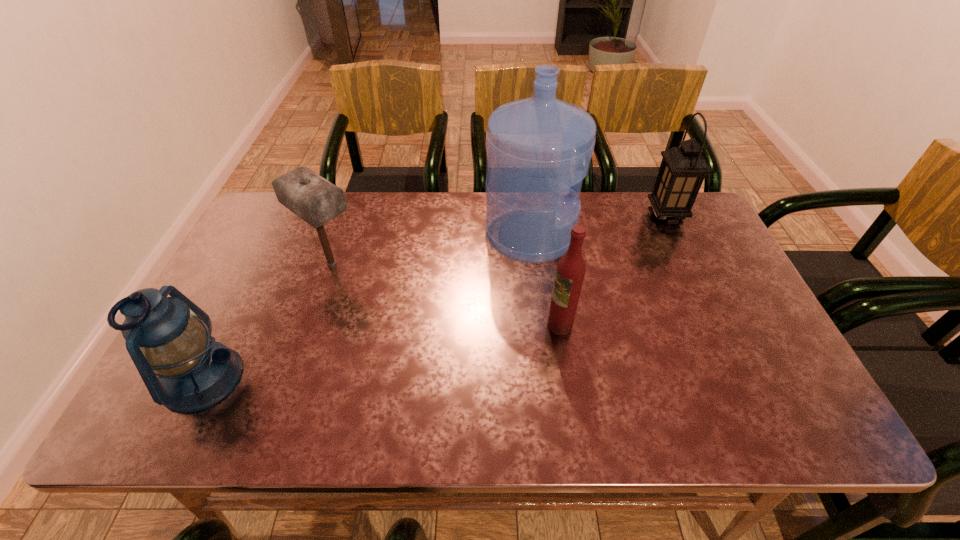
Locate an element on the screen. Image resolution: width=960 pixels, height=540 pixels. water jug is located at coordinates (539, 149).

I want to click on the farther lantern, so click(683, 169).

This screenshot has width=960, height=540. I want to click on the right lantern, so point(683,169).

Where is `mallet`? This screenshot has width=960, height=540. mallet is located at coordinates (314, 199).

Where is `liquor`? liquor is located at coordinates (570, 271).

Find the location of a particular element. Image resolution: width=960 pixels, height=540 pixels. the shorter lantern is located at coordinates (195, 372).

Where is `the leftmost object`? This screenshot has width=960, height=540. the leftmost object is located at coordinates (195, 372).

Locate an element on the screen. vacant space located 0.100m on the side of the tallest object with the handle is located at coordinates (608, 235).

In order to click on free space located 0.340m on the left of the farther lantern in this screenshot , I will do `click(540, 215)`.

I want to click on free region located 0.110m on the right of the mallet, so click(x=402, y=263).